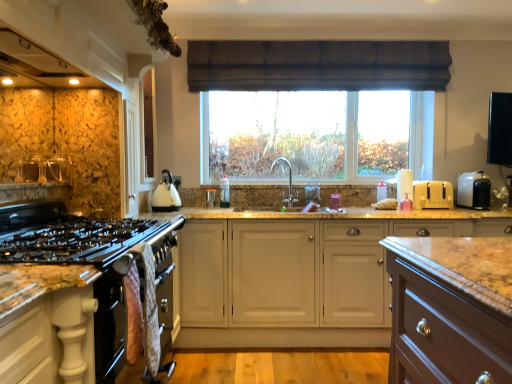
In order to click on free location above matte white exhaust hood at upper left (from a real-world perspective) in this screenshot , I will do tap(34, 56).